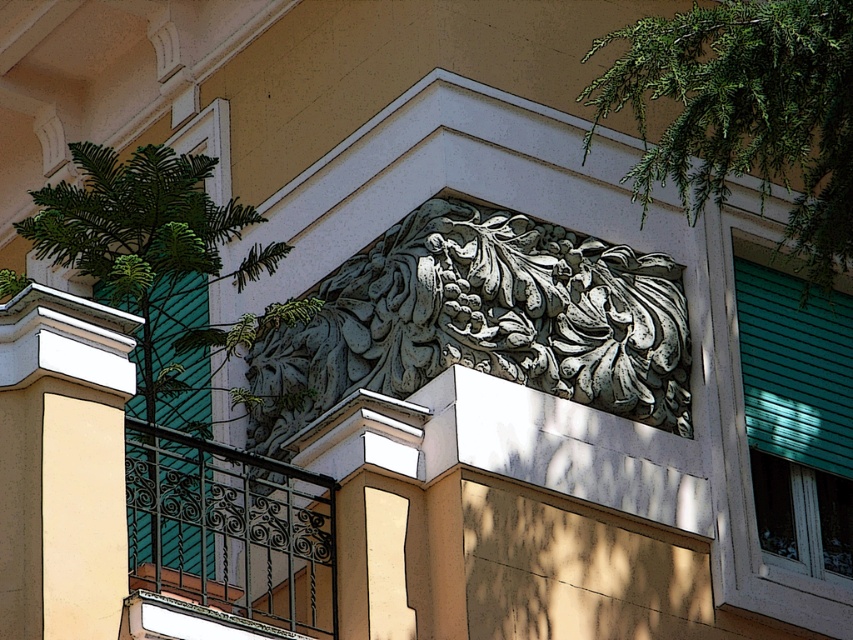
In the scene shown: You are an architect examining the building facade. You need to install a new light fixture between the green patina stone carving at center and the white smooth pillar at left. Which object should the light fixture be closer to if it needs to be placed proportionally to their sizes?

The green patina stone carving at center is larger than the white smooth pillar at left, so the light fixture should be placed closer to the white smooth pillar at left to maintain proportional spacing between them.

You are an architect analyzing the building facade. You notice the green leafy branch at upper right and the black wrought iron balcony at lower left. Which object appears bigger in the image?

The green leafy branch at upper right has a larger size compared to the black wrought iron balcony at lower left, so the green leafy branch at upper right appears bigger in the image.

You are an architect examining the building facade. You need to determine if the green patina stone carving at center can fit horizontally within the space currently occupied by the green leafy branch at upper right. Can it fit?

The green patina stone carving at center might be wider than green leafy branch at upper right, so it may not fit horizontally within the space currently occupied by the green leafy branch at upper right.